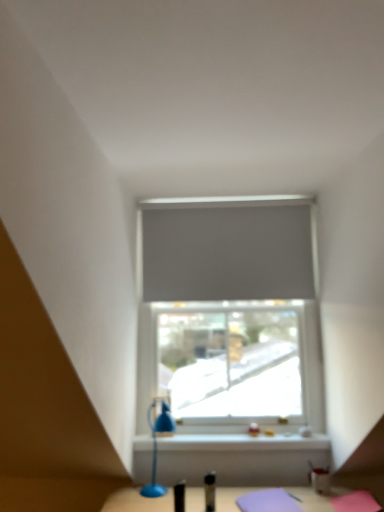
Question: Considering the relative sizes of matte gray roller blind at center and gray matte curtain at center in the image provided, is matte gray roller blind at center taller than gray matte curtain at center?

Choices:
 (A) no
 (B) yes

Answer: (B)

Question: From the image's perspective, is matte gray roller blind at center on gray matte curtain at center?

Choices:
 (A) yes
 (B) no

Answer: (B)

Question: Considering the relative sizes of matte gray roller blind at center and gray matte curtain at center in the image provided, is matte gray roller blind at center wider than gray matte curtain at center?

Choices:
 (A) yes
 (B) no

Answer: (B)

Question: Is matte gray roller blind at center smaller than gray matte curtain at center?

Choices:
 (A) yes
 (B) no

Answer: (B)

Question: Is matte gray roller blind at center oriented towards gray matte curtain at center?

Choices:
 (A) no
 (B) yes

Answer: (B)

Question: Considering the positions of blue plastic table lamp at lower center and gray matte curtain at center in the image, is blue plastic table lamp at lower center taller or shorter than gray matte curtain at center?

Choices:
 (A) tall
 (B) short

Answer: (B)

Question: From the image's perspective, relative to gray matte curtain at center, is blue plastic table lamp at lower center above or below?

Choices:
 (A) below
 (B) above

Answer: (A)

Question: From a real-world perspective, is blue plastic table lamp at lower center positioned above or below gray matte curtain at center?

Choices:
 (A) below
 (B) above

Answer: (A)

Question: Is point 160,432 closer or farther from the camera than point 152,268?

Choices:
 (A) closer
 (B) farther

Answer: (A)

Question: From a real-world perspective, is gray matte curtain at center above or below blue plastic table lamp at lower center?

Choices:
 (A) above
 (B) below

Answer: (A)

Question: Is gray matte curtain at center taller or shorter than blue plastic table lamp at lower center?

Choices:
 (A) tall
 (B) short

Answer: (A)

Question: Would you say gray matte curtain at center is to the left or to the right of blue plastic table lamp at lower center in the picture?

Choices:
 (A) left
 (B) right

Answer: (B)

Question: Is point (175, 238) positioned closer to the camera than point (150, 488)?

Choices:
 (A) closer
 (B) farther

Answer: (B)

Question: From the image's perspective, is matte gray roller blind at center located above or below gray matte curtain at center?

Choices:
 (A) above
 (B) below

Answer: (B)

Question: Is point (200, 378) positioned closer to the camera than point (182, 215)?

Choices:
 (A) closer
 (B) farther

Answer: (B)